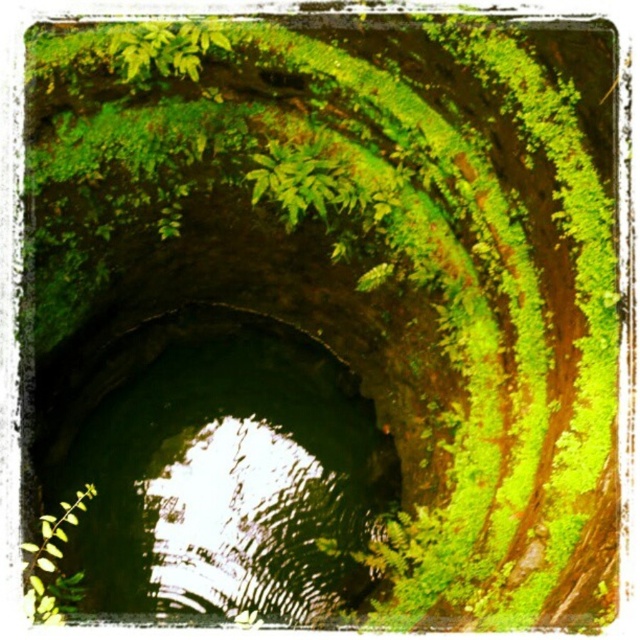
Question: Which of the following is the closest to the observer?

Choices:
 (A) green mossy hole at center
 (B) green leafy plant at lower left

Answer: (B)

Question: Is green mossy hole at center to the left of green leafy plant at lower left from the viewer's perspective?

Choices:
 (A) no
 (B) yes

Answer: (A)

Question: Among these points, which one is nearest to the camera?

Choices:
 (A) (40, 531)
 (B) (86, 525)

Answer: (A)

Question: Does green mossy hole at center have a lesser width compared to green leafy plant at lower left?

Choices:
 (A) no
 (B) yes

Answer: (A)

Question: Is green mossy hole at center below green leafy plant at lower left?

Choices:
 (A) yes
 (B) no

Answer: (B)